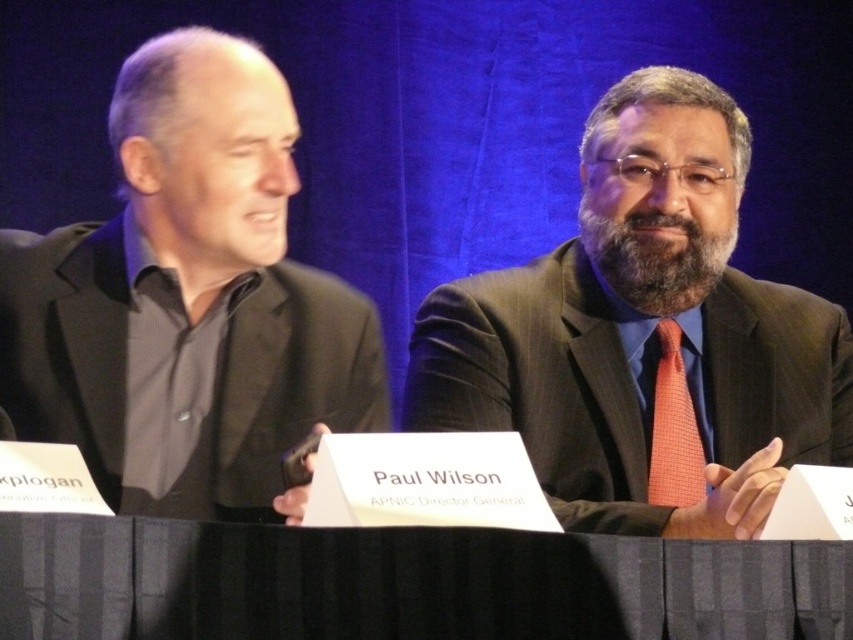
Question: Is matte black suit at right positioned at the back of black fabric table at center?

Choices:
 (A) no
 (B) yes

Answer: (B)

Question: Is matte black suit at right positioned at the back of black matte suit at left?

Choices:
 (A) yes
 (B) no

Answer: (A)

Question: Among these objects, which one is farthest from the camera?

Choices:
 (A) orange checkered tie at center
 (B) black fabric table at center
 (C) matte black suit at right
 (D) black matte suit at left

Answer: (A)

Question: Which point is closer to the camera?

Choices:
 (A) (137, 208)
 (B) (659, 320)
 (C) (432, 572)

Answer: (C)

Question: Does matte black suit at right come in front of black matte suit at left?

Choices:
 (A) yes
 (B) no

Answer: (B)

Question: Estimate the real-world distances between objects in this image. Which object is closer to the black matte suit at left?

Choices:
 (A) matte black suit at right
 (B) orange checkered tie at center

Answer: (A)